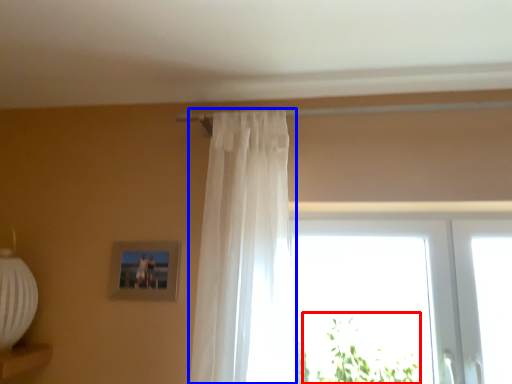
Question: Which object is further to the camera taking this photo, plant (highlighted by a red box) or curtain (highlighted by a blue box)?

Choices:
 (A) plant
 (B) curtain

Answer: (A)